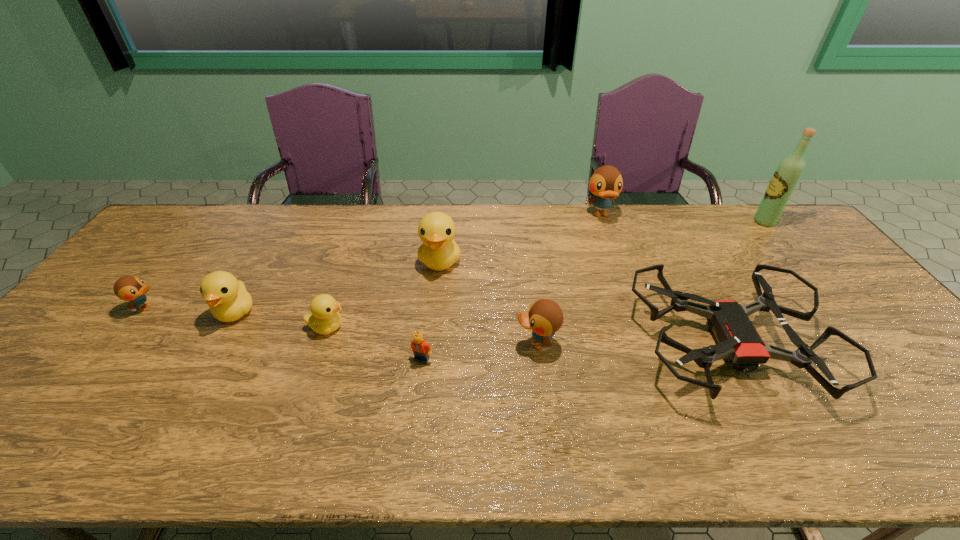
Where is `wine bottle`? The height and width of the screenshot is (540, 960). wine bottle is located at coordinates (787, 175).

Locate an element on the screen. The height and width of the screenshot is (540, 960). white wine bottle is located at coordinates (787, 175).

Locate an element on the screen. This screenshot has height=540, width=960. the biggest blue duck is located at coordinates (606, 183).

Where is `the farthest duck`? Image resolution: width=960 pixels, height=540 pixels. the farthest duck is located at coordinates (606, 183).

Locate an element on the screen. The image size is (960, 540). the farthest yellow duck is located at coordinates (439, 251).

Locate an element on the screen. the second farthest duck is located at coordinates (439, 251).

Where is `the second smallest yellow duck`? The image size is (960, 540). the second smallest yellow duck is located at coordinates (228, 300).

Find the location of `the second duck from left to right`. the second duck from left to right is located at coordinates (228, 300).

You are a GUI agent. You are given a task and a screenshot of the screen. Output one action in this format:
    pyautogui.click(x=<x>, y=<y>)
    Task: Click on the second duck from right to left
    Image resolution: width=960 pixels, height=540 pixels.
    Given the screenshot: What is the action you would take?
    pyautogui.click(x=545, y=317)

What are the coordinates of `the second blue duck from right to left` in the screenshot? It's located at (545, 317).